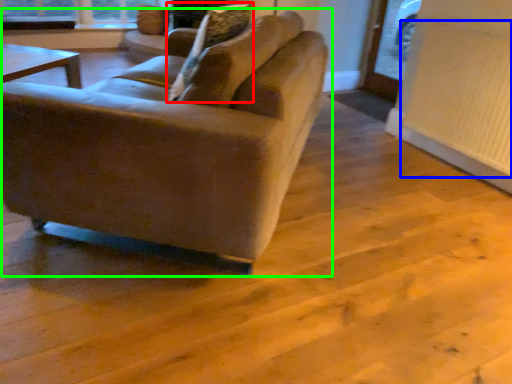
Question: Estimate the real-world distances between objects in this image. Which object is closer to pillow (highlighted by a red box), radiator (highlighted by a blue box) or studio couch (highlighted by a green box)?

Choices:
 (A) radiator
 (B) studio couch

Answer: (B)